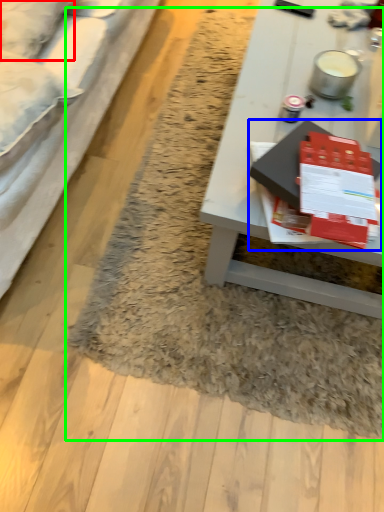
Question: Based on their relative distances, which object is farther from pillow (highlighted by a red box)? Choose from magazine (highlighted by a blue box) and mat (highlighted by a green box).

Choices:
 (A) magazine
 (B) mat

Answer: (B)